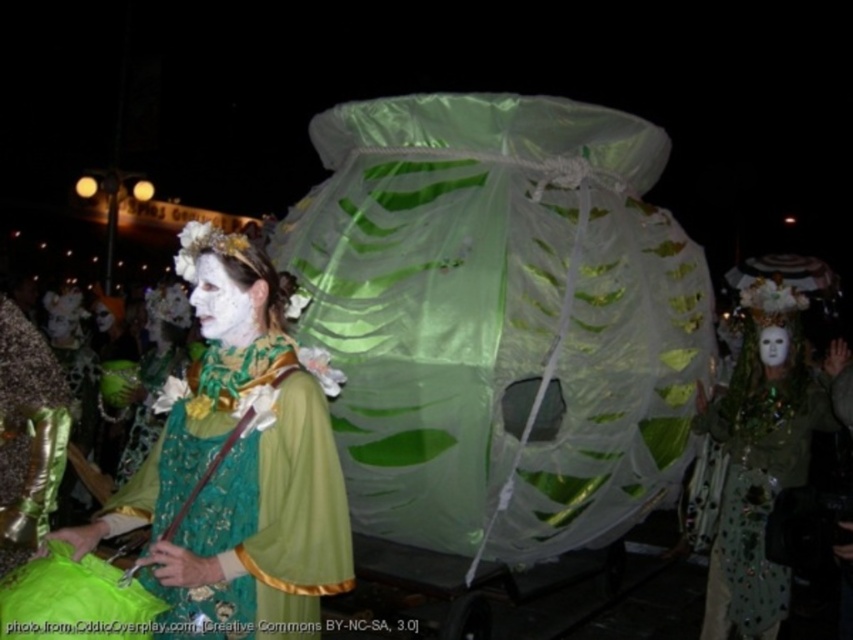
Question: Is green sequined mask at center further to the viewer compared to white matte face at center?

Choices:
 (A) no
 (B) yes

Answer: (B)

Question: Is green lace dress at center to the left of white matte face at center from the viewer's perspective?

Choices:
 (A) no
 (B) yes

Answer: (B)

Question: Is green sequined mask at center above white matte mask at center?

Choices:
 (A) yes
 (B) no

Answer: (B)

Question: Estimate the real-world distances between objects in this image. Which object is farther from the white matte face at center?

Choices:
 (A) white matte mask at center
 (B) green lace dress at center
 (C) green sequined mask at center

Answer: (A)

Question: Which object appears farthest from the camera in this image?

Choices:
 (A) white matte mask at center
 (B) green sequined mask at center
 (C) white matte face at center
 (D) green lace dress at center

Answer: (A)

Question: Which point is closer to the camera taking this photo?

Choices:
 (A) (763, 332)
 (B) (202, 333)

Answer: (B)